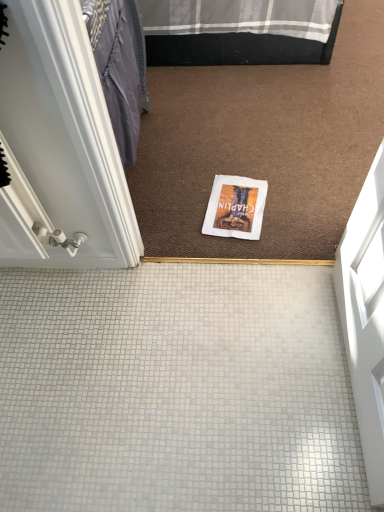
Question: From the image's perspective, is white glossy door at left positioned above or below white tile floor at center?

Choices:
 (A) above
 (B) below

Answer: (A)

Question: Is point (64, 95) positioned closer to the camera than point (324, 335)?

Choices:
 (A) farther
 (B) closer

Answer: (B)

Question: Which of these objects is positioned farthest from the white paper magazine at center?

Choices:
 (A) white tile floor at center
 (B) white glossy door at left

Answer: (B)

Question: Estimate the real-world distances between objects in this image. Which object is closer to the white tile floor at center?

Choices:
 (A) white paper magazine at center
 (B) white glossy door at left

Answer: (B)